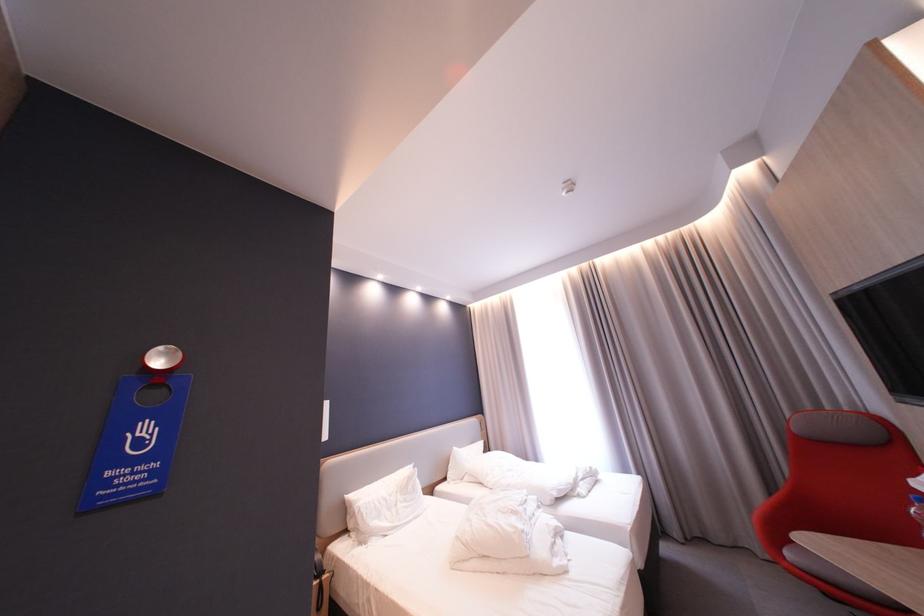
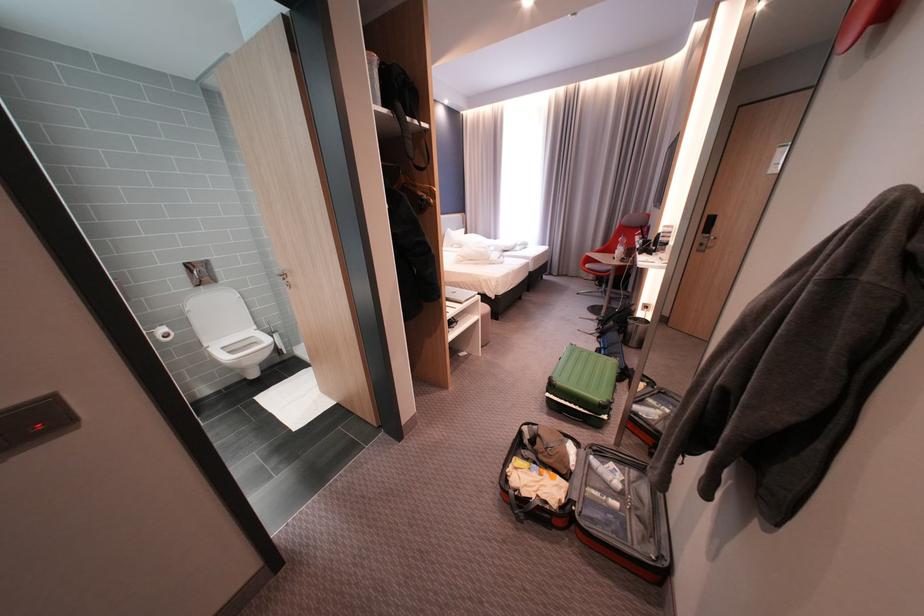
Locate, in the second image, the point that corresponds to (800,554) in the first image.

(598, 265)